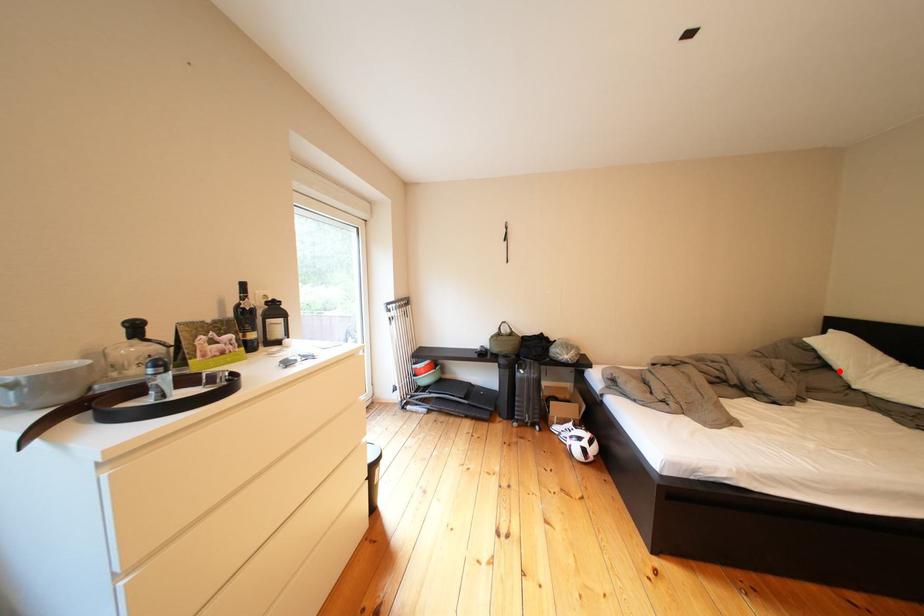
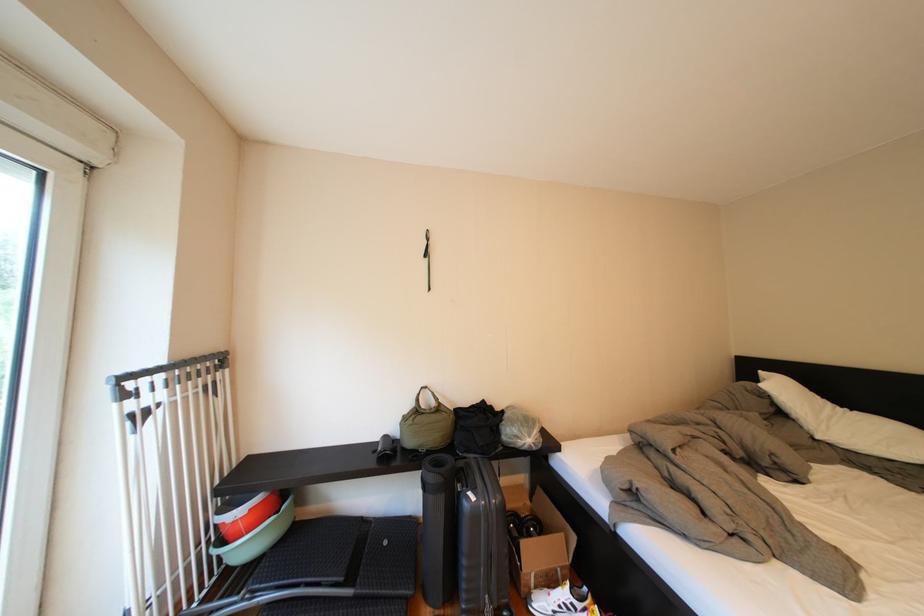
Question: I am providing you with two images of the same scene from different viewpoints. Given a red point in image1, look at the same physical point in image2. Is it:

Choices:
 (A) Closer to the viewpoint
 (B) Farther from the viewpoint

Answer: (A)